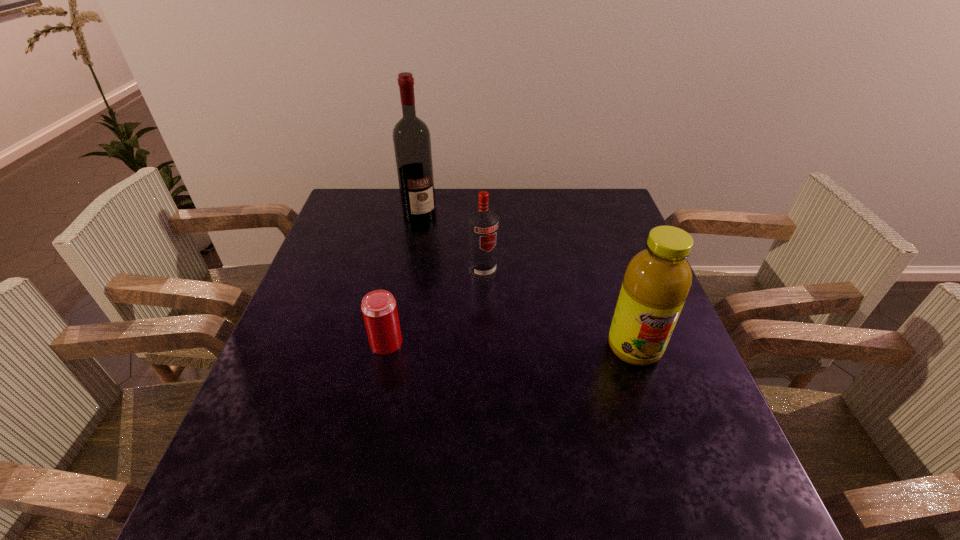
In order to click on vacant area between the vodka and the fruit juice in this screenshot , I will do `click(559, 310)`.

Locate an element on the screen. This screenshot has width=960, height=540. vacant area that lies between the rightmost object and the farthest object is located at coordinates (527, 281).

Find the location of `free space between the beer can and the third shortest object`. free space between the beer can and the third shortest object is located at coordinates [511, 345].

Identify the location of vacant space that's between the vodka and the alcohol. The image size is (960, 540). (451, 244).

You are a GUI agent. You are given a task and a screenshot of the screen. Output one action in this format:
    pyautogui.click(x=<x>, y=<y>)
    Task: Click on the third closest object to the farthest object
    This screenshot has width=960, height=540.
    Given the screenshot: What is the action you would take?
    pyautogui.click(x=657, y=280)

Point out which object is positioned as the second nearest to the rightmost object. Please provide its 2D coordinates. Your answer should be formatted as a tuple, i.e. [(x, y)], where the tuple contains the x and y coordinates of a point satisfying the conditions above.

[(379, 309)]